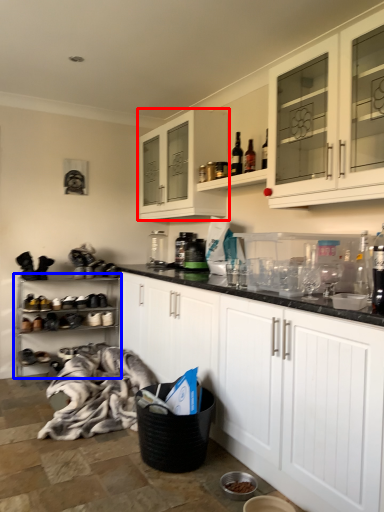
Question: Which point is further to the camera, cabinetry (highlighted by a red box) or shelf (highlighted by a blue box)?

Choices:
 (A) cabinetry
 (B) shelf

Answer: (B)